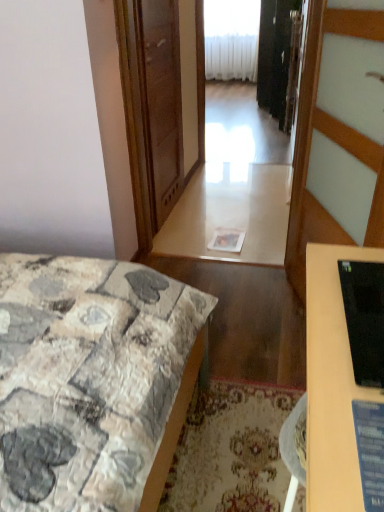
The image size is (384, 512). What are the coordinates of `free point below carpeted mat at lower center (from a real-world perspective)` in the screenshot? It's located at (234, 447).